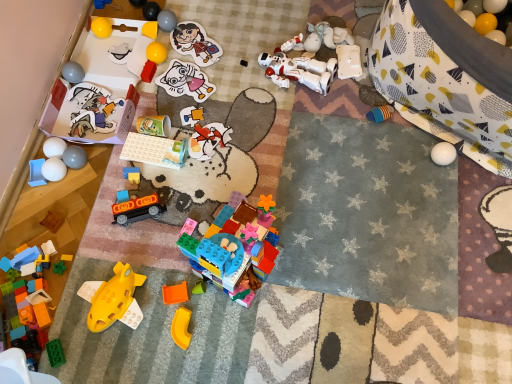
At what (x,y) coordinates should I click in order to perform the action: click on vacant space that is to the left of translucent orange plastic toy at center, the fourth toy in the right-to-left sequence. Please return your answer as a coordinate pair (x, y). The image size is (512, 384). Looking at the image, I should click on (142, 293).